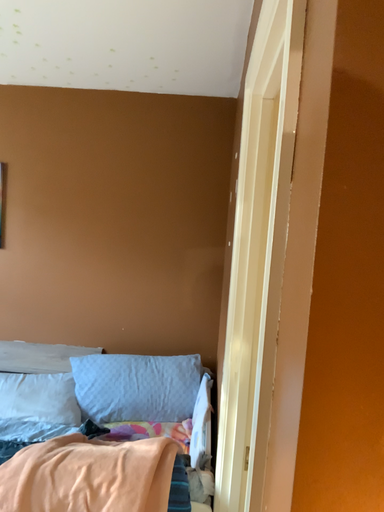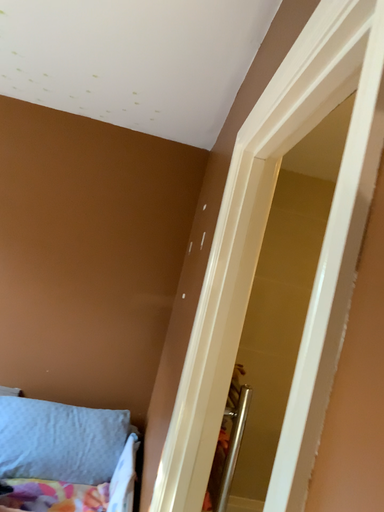
Question: Which way did the camera rotate in the video?

Choices:
 (A) rotated right
 (B) rotated left

Answer: (A)